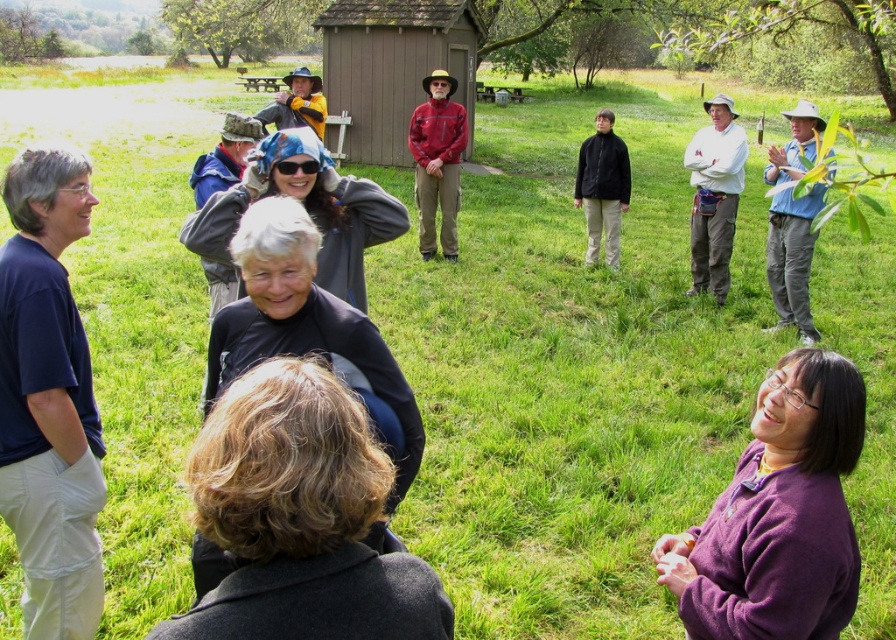
Question: Which point is farther to the camera?

Choices:
 (A) (780, 593)
 (B) (188, 465)
 (C) (24, 28)

Answer: (C)

Question: Among these points, which one is nearest to the camera?

Choices:
 (A) (744, 10)
 (B) (438, 84)

Answer: (B)

Question: Does wooden hut at center appear under blue fabric shirt at right?

Choices:
 (A) no
 (B) yes

Answer: (A)

Question: Based on their relative distances, which object is nearer to the wooden hut at center?

Choices:
 (A) green textured tree at upper left
 (B) blue fabric shirt at right
 (C) purple fleece at lower right

Answer: (B)

Question: Can you confirm if dark blue shirt at left is thinner than black matte jacket at center?

Choices:
 (A) no
 (B) yes

Answer: (A)

Question: Does dark blue shirt at left have a greater width compared to green textured tree at upper left?

Choices:
 (A) no
 (B) yes

Answer: (A)